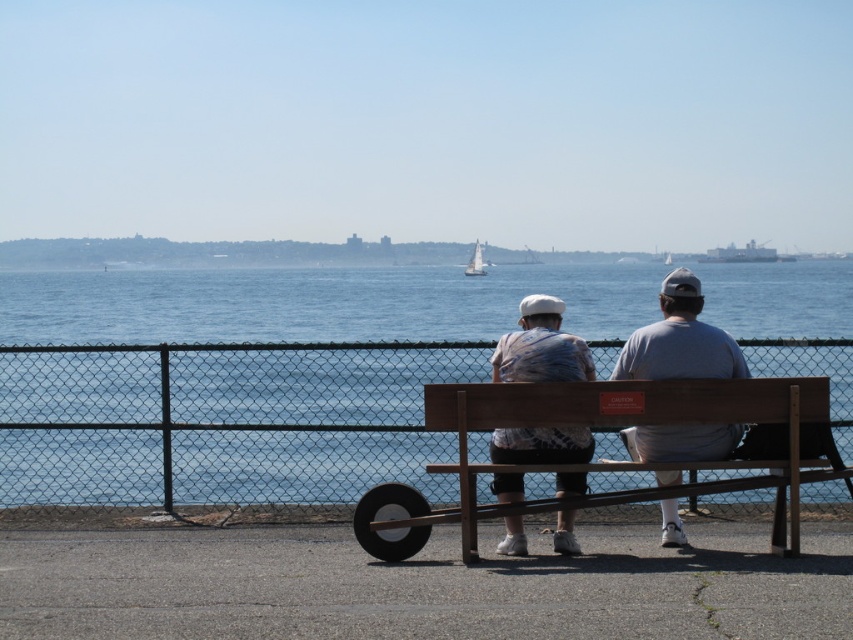
You are standing at the origin point of the image coordinate system. The wooden bench at center is located at point (630, 422). If you want to walk to the wooden bench at center, in which direction should you move relative to the image?

The wooden bench at center is located at point (630, 422). Since the coordinate system typically has the origin at the top left corner, moving towards the center would involve moving to the right and down from the origin. However, without specific coordinate directions, the general direction is towards the center of the image.

You are standing at the chain link fence in the waterfront scene. You see two points marked in the image. Which point is closer to you, point (28, 401) or point (755, 260)?

Point (28, 401) is closer to you than point (755, 260).

You are standing at the point labeled as point (480, 268) and want to walk to the point labeled as point (735, 483). Given the scene described, is there an unobstructed path between these two points?

Yes, there is an unobstructed path between point (480, 268) and point (735, 483) because point (735, 483) is in front of point (480, 268), indicating they are aligned along the same line of sight without any blocking objects.